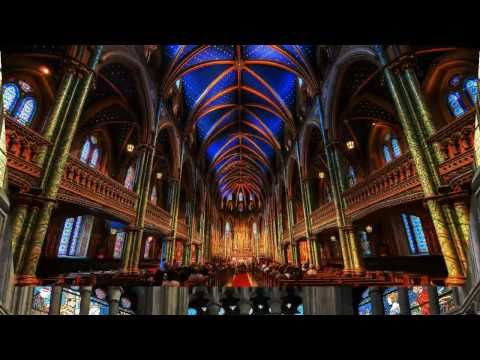
At what (x,y) coordinates should I click in order to perform the action: click on arched cieling. Please return your answer as a coordinate pair (x, y). Looking at the image, I should click on (243, 104).